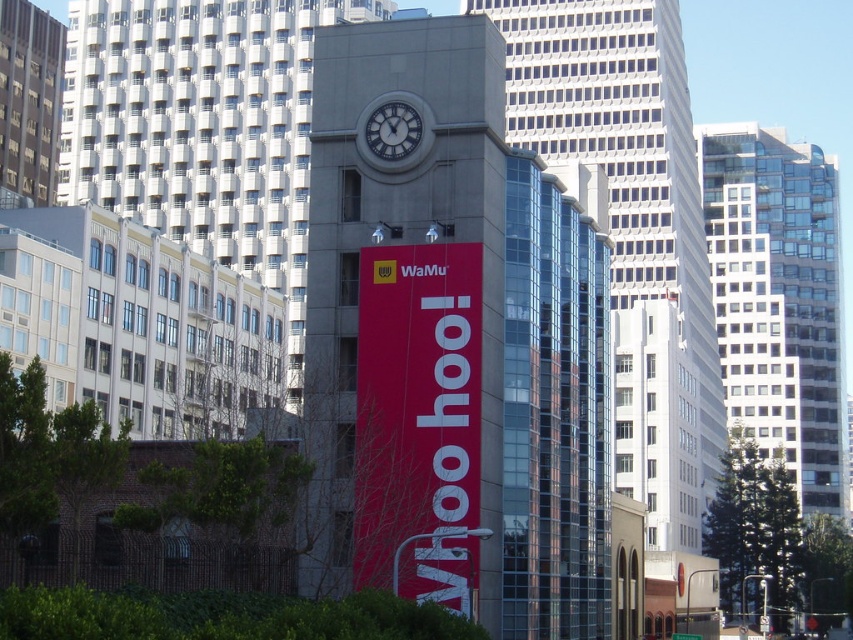
Question: Can you confirm if concrete clock tower at center is smaller than metallic clock face at center?

Choices:
 (A) yes
 (B) no

Answer: (B)

Question: Which of these objects is positioned farthest from the white textured building at center?

Choices:
 (A) concrete clock tower at center
 (B) metallic clock face at center

Answer: (B)

Question: Does concrete clock tower at center have a larger size compared to matte red banner at center?

Choices:
 (A) no
 (B) yes

Answer: (B)

Question: Which point appears closest to the camera in this image?

Choices:
 (A) (403, 509)
 (B) (471, 97)

Answer: (A)

Question: Which point is closer to the camera?

Choices:
 (A) (288, 276)
 (B) (450, 417)

Answer: (B)

Question: Does matte red banner at center appear on the right side of metallic clock face at center?

Choices:
 (A) no
 (B) yes

Answer: (B)